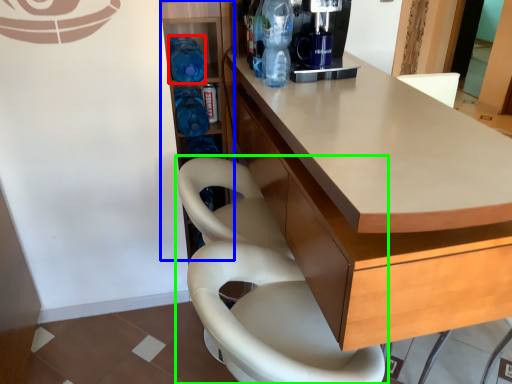
Question: Considering the real-world distances, which object is farthest from bottle (highlighted by a red box)? shelf (highlighted by a blue box) or chair (highlighted by a green box)?

Choices:
 (A) shelf
 (B) chair

Answer: (B)